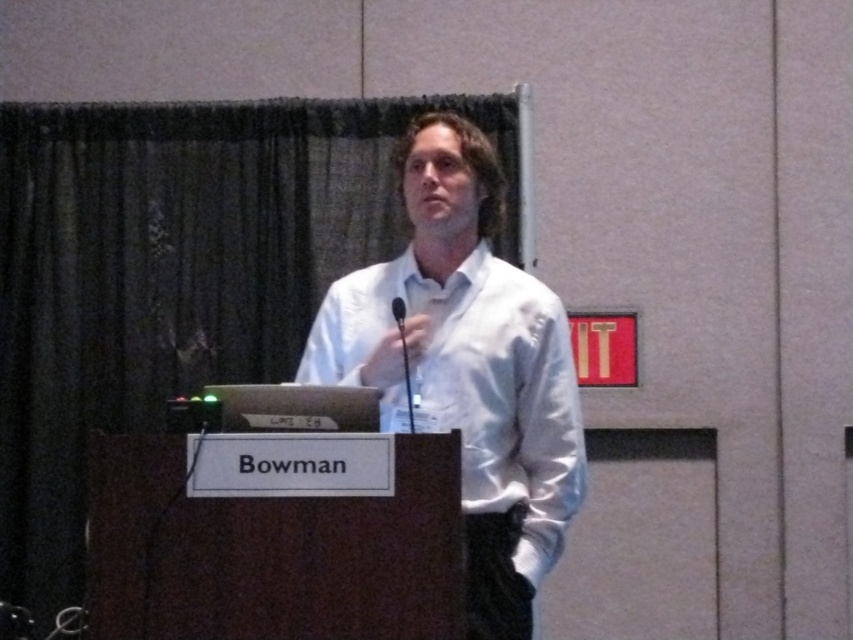
You are a photographer setting up for a speech event. You want to capture a closeup of the speaker wearing the white satin shirt at center. The camera you are using has a minimum focusing distance of 1.5 meters. Can you take the closeup without moving the camera or the speaker?

The white satin shirt at center is 1.87 meters from the camera, which is beyond the minimum focusing distance of 1.5 meters. Therefore, the photographer can take the closeup without moving the camera or the speaker.

You are an event organizer checking the stage setup. You notice the white satin shirt at center and the black matte microphone at center. Which object is positioned lower in the scene?

The white satin shirt at center is located below the black matte microphone at center, so the white satin shirt at center is positioned lower in the scene.